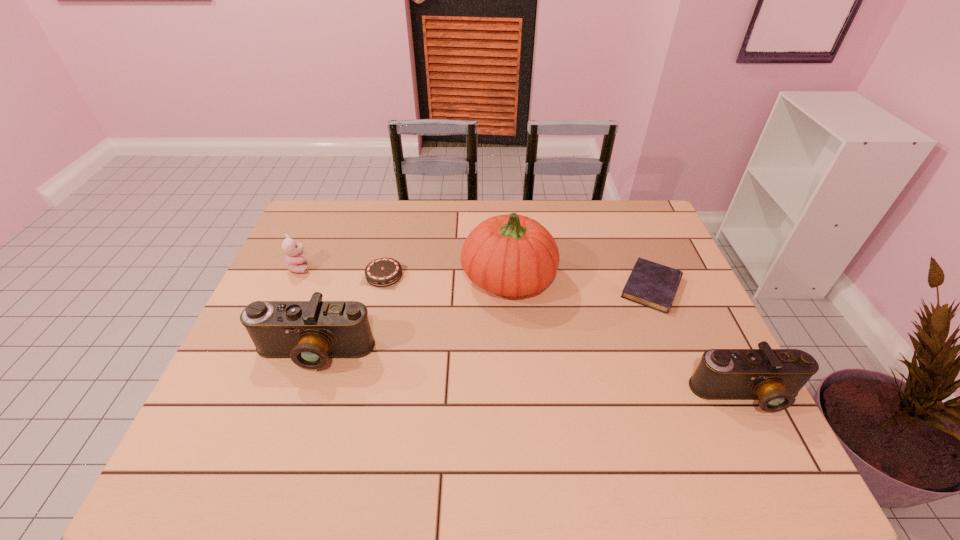
This screenshot has width=960, height=540. Identify the location of the taller camera. (310, 332).

Locate an element on the screen. Image resolution: width=960 pixels, height=540 pixels. the second tallest object is located at coordinates (310, 332).

Find the location of a particular element. The height and width of the screenshot is (540, 960). the right camera is located at coordinates (774, 377).

The height and width of the screenshot is (540, 960). What are the coordinates of `the shortest object` in the screenshot? It's located at (650, 284).

The height and width of the screenshot is (540, 960). Identify the location of pumpkin. (512, 255).

The height and width of the screenshot is (540, 960). I want to click on the tallest object, so click(x=512, y=255).

Locate an element on the screen. Image resolution: width=960 pixels, height=540 pixels. the second shortest object is located at coordinates (382, 272).

Locate an element on the screen. teddy bear is located at coordinates (295, 262).

Locate an element on the screen. This screenshot has height=540, width=960. free space located on the lens of the taller camera is located at coordinates (293, 415).

The height and width of the screenshot is (540, 960). I want to click on free point located on the front of the shortest object, so click(x=668, y=329).